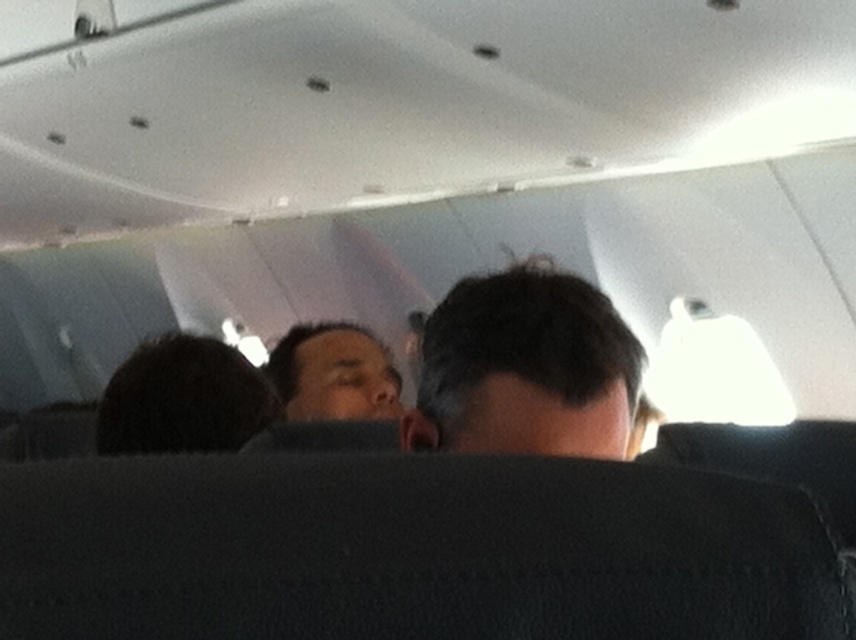
Who is higher up, dark brown hair at upper center or matte skin nose at center?

Positioned higher is dark brown hair at upper center.

Between point (535, 310) and point (383, 376), which one is positioned in front?

Point (535, 310) is in front.

The image size is (856, 640). Find the location of `dark brown hair at upper center`. dark brown hair at upper center is located at coordinates (525, 369).

I want to click on dark brown hair at upper center, so click(525, 369).

Is dark brown hair at upper center below matte skin face at center?

No.

Does dark brown hair at upper center have a larger size compared to matte skin face at center?

No.

Is point (501, 394) farther from camera compared to point (310, 388)?

That is False.

Identify the location of dark brown hair at upper center. Image resolution: width=856 pixels, height=640 pixels. (525, 369).

Which of these two, matte skin face at center or matte skin nose at center, stands taller?

With more height is matte skin face at center.

Does matte skin face at center appear on the left side of matte skin nose at center?

Correct, you'll find matte skin face at center to the left of matte skin nose at center.

This screenshot has height=640, width=856. Identify the location of matte skin face at center. (334, 372).